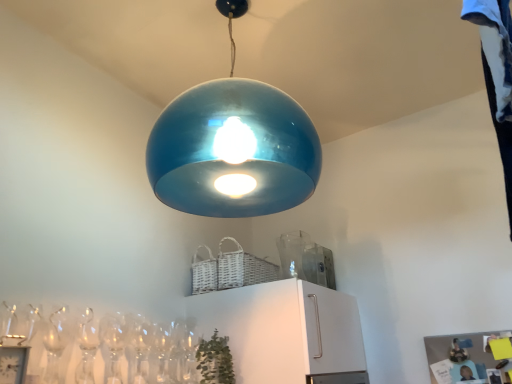
This screenshot has height=384, width=512. What do you see at coordinates (233, 146) in the screenshot?
I see `glossy blue pendant light at center` at bounding box center [233, 146].

Measure the distance between point (x=290, y=261) and camera.

A distance of 1.94 meters exists between point (x=290, y=261) and camera.

Identify the location of green matte plant at lower center. (215, 360).

Considering the relative sizes of green matte plant at lower center and glossy blue pendant light at center in the image provided, is green matte plant at lower center smaller than glossy blue pendant light at center?

Indeed, green matte plant at lower center has a smaller size compared to glossy blue pendant light at center.

Is glossy blue pendant light at center inside green matte plant at lower center?

No, glossy blue pendant light at center is not inside green matte plant at lower center.

What's the angular difference between green matte plant at lower center and glossy blue pendant light at center's facing directions?

8.42 degrees.

Considering the relative positions of green matte plant at lower center and glossy blue pendant light at center in the image provided, is green matte plant at lower center to the left or to the right of glossy blue pendant light at center?

green matte plant at lower center is to the left of glossy blue pendant light at center.

From the image's perspective, is glossy blue pendant light at center above green matte plant at lower center?

Yes, from the image's perspective, glossy blue pendant light at center is above green matte plant at lower center.

Which object is further away from the camera, glossy blue pendant light at center or green matte plant at lower center?

Positioned behind is green matte plant at lower center.

Is glossy blue pendant light at center at the left side of green matte plant at lower center?

No, glossy blue pendant light at center is not to the left of green matte plant at lower center.

Consider the image. From a real-world perspective, which is physically above, glossy blue pendant light at center or green matte plant at lower center?

glossy blue pendant light at center is physically above.

From the image's perspective, which is below, transparent glass vase at upper center or glossy blue pendant light at center?

transparent glass vase at upper center is shown below in the image.

Does point (303, 234) come behind point (298, 121)?

Yes, it is behind point (298, 121).

Is transparent glass vase at upper center not near glossy blue pendant light at center?

That's not correct — transparent glass vase at upper center is a little close to glossy blue pendant light at center.

Do you think glossy blue pendant light at center is within transparent glass vase at upper center, or outside of it?

glossy blue pendant light at center is not enclosed by transparent glass vase at upper center.

Are glossy blue pendant light at center and transparent glass vase at upper center making contact?

No.

Can you confirm if glossy blue pendant light at center is wider than transparent glass vase at upper center?

Yes, glossy blue pendant light at center is wider than transparent glass vase at upper center.

Could you tell me if glossy blue pendant light at center is facing transparent glass vase at upper center?

No.

What's the angular difference between green matte plant at lower center and transparent glass vase at upper center's facing directions?

There is a 84.9-degree angle between the facing directions of green matte plant at lower center and transparent glass vase at upper center.

Considering the relative positions of green matte plant at lower center and transparent glass vase at upper center in the image provided, is green matte plant at lower center in front of transparent glass vase at upper center?

Yes, green matte plant at lower center is closer to the camera.

Is green matte plant at lower center turned away from transparent glass vase at upper center?

No, green matte plant at lower center is not facing the opposite direction of transparent glass vase at upper center.

Looking at their sizes, would you say transparent glass vase at upper center is wider or thinner than green matte plant at lower center?

Considering their sizes, transparent glass vase at upper center looks broader than green matte plant at lower center.

From their relative heights in the image, would you say transparent glass vase at upper center is taller or shorter than green matte plant at lower center?

Considering their sizes, transparent glass vase at upper center has more height than green matte plant at lower center.

Between transparent glass vase at upper center and green matte plant at lower center, which one has larger size?

green matte plant at lower center is bigger.

Which object is positioned more to the right, transparent glass vase at upper center or green matte plant at lower center?

From the viewer's perspective, transparent glass vase at upper center appears more on the right side.

What are the coordinates of `lamp on the right of green matte plant at lower center` in the screenshot? It's located at (233, 146).

What are the coordinates of `lamp that is above the green matte plant at lower center (from a real-world perspective)` in the screenshot? It's located at (233, 146).

Which object lies further to the anchor point transparent glass vase at upper center, green matte plant at lower center or glossy blue pendant light at center?

Among the two, green matte plant at lower center is located further to transparent glass vase at upper center.

Considering their positions, is transparent glass vase at upper center positioned closer to green matte plant at lower center than glossy blue pendant light at center?

Among the two, transparent glass vase at upper center is located nearer to green matte plant at lower center.

Which object lies further to the anchor point glossy blue pendant light at center, green matte plant at lower center or transparent glass vase at upper center?

The object further to glossy blue pendant light at center is green matte plant at lower center.

Based on their spatial positions, is transparent glass vase at upper center or green matte plant at lower center further from glossy blue pendant light at center?

green matte plant at lower center.

Looking at this image, when comparing their distances from transparent glass vase at upper center, does glossy blue pendant light at center or green matte plant at lower center seem further?

Based on the image, green matte plant at lower center appears to be further to transparent glass vase at upper center.

Based on the photo, from the image, which object appears to be farther from green matte plant at lower center, glossy blue pendant light at center or transparent glass vase at upper center?

glossy blue pendant light at center is positioned further to the anchor green matte plant at lower center.

The width and height of the screenshot is (512, 384). In order to click on plant between glossy blue pendant light at center and transparent glass vase at upper center in the front-back direction in this screenshot , I will do `click(215, 360)`.